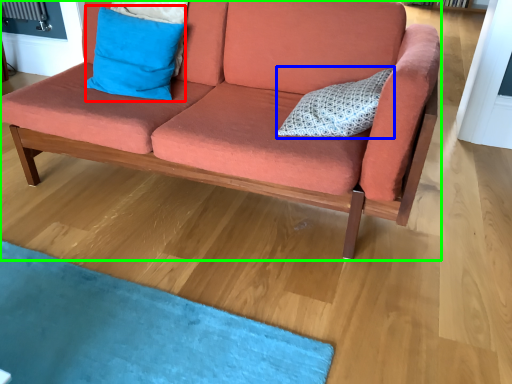
Question: Considering the real-world distances, which object is farthest from pillow (highlighted by a red box)? pillow (highlighted by a blue box) or studio couch (highlighted by a green box)?

Choices:
 (A) pillow
 (B) studio couch

Answer: (A)